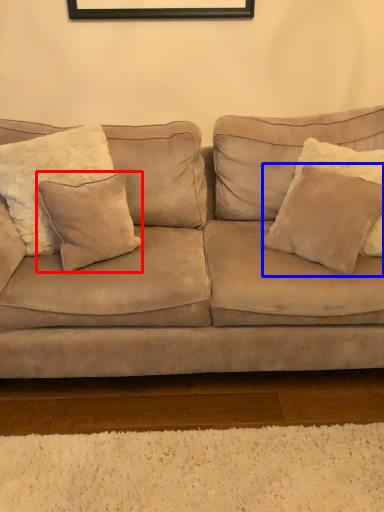
Question: Which object appears closest to the camera in this image, pillow (highlighted by a red box) or pillow (highlighted by a blue box)?

Choices:
 (A) pillow
 (B) pillow

Answer: (B)